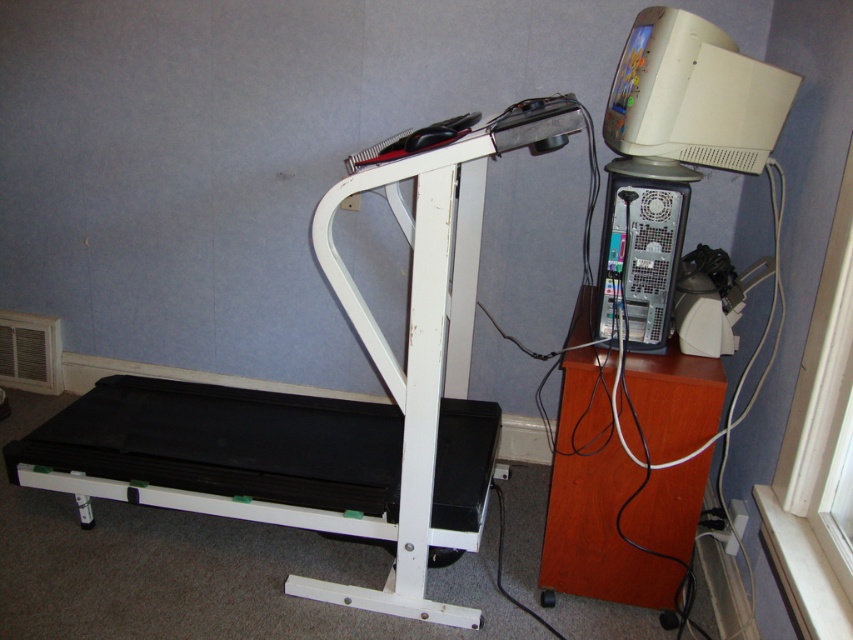
You are setting up a new shelf to organize your home office. The shelf has a maximum weight capacity of 15 kilograms. You need to decide whether to place the beige plastic monitor at upper right or the satin silver computer tower at right on the shelf. Based on their sizes, which item is more likely to exceed the weight limit?

The beige plastic monitor at upper right is bigger than the satin silver computer tower at right. Since larger monitors typically weigh more than smaller ones, the beige plastic monitor at upper right is more likely to exceed the shelf weight limit of 15 kilograms.

You are standing in the room and want to move from the white plastic air conditioner at lower left to the black rubber treadmill at left. Which direction should you move towards?

You should move towards the right side to reach the black rubber treadmill at left from the white plastic air conditioner at lower left since the treadmill is positioned on the right side of the air conditioner.

You are setting up a new shelf to organize your home office. The shelf you have is 1.2 meters tall. You want to place both the beige plastic monitor at upper right and the satin silver computer tower at right on the shelf. Can both items fit vertically on the shelf without exceeding its height?

The beige plastic monitor at upper right is not as tall as the satin silver computer tower at right. Since the shelf is 1.2 meters tall, both items can fit vertically as long as their combined height does not exceed the shelf height. However, the exact dimensions of each item are not provided, so it depends on their individual heights.